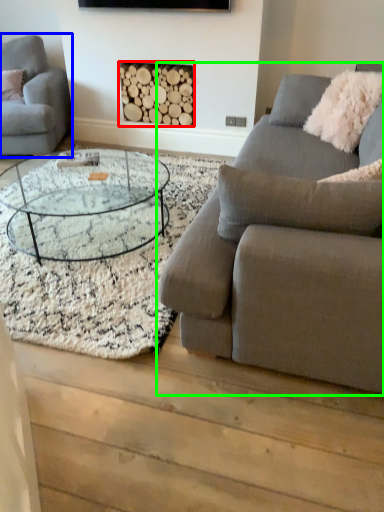
Question: Which object is positioned farthest from fireplace (highlighted by a red box)? Select from studio couch (highlighted by a blue box) and studio couch (highlighted by a green box).

Choices:
 (A) studio couch
 (B) studio couch

Answer: (B)